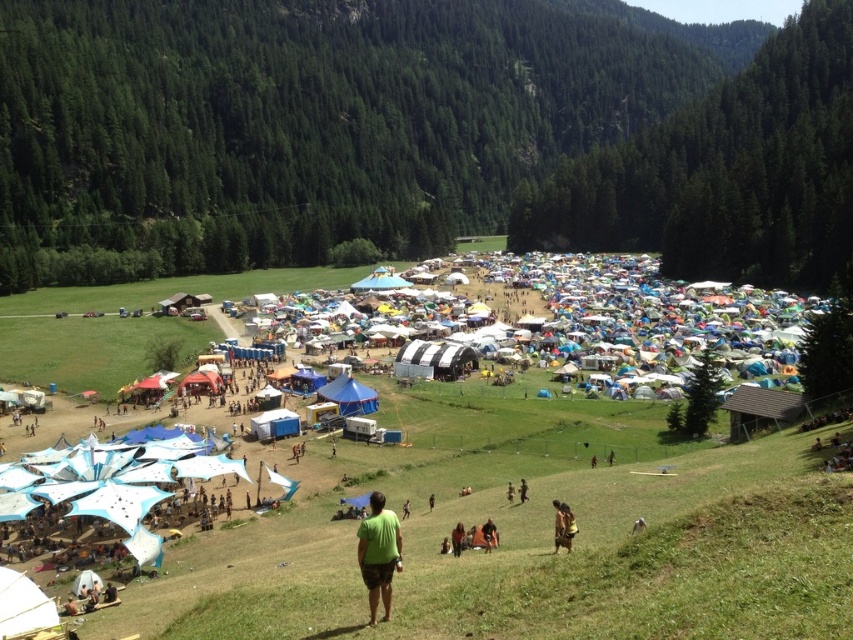
Question: Which of the following is the farthest from the observer?

Choices:
 (A) blue fabric tent at center
 (B) green matte shirt at lower center

Answer: (A)

Question: Where is green matte shirt at lower center located in relation to blue fabric tent at center in the image?

Choices:
 (A) above
 (B) below

Answer: (B)

Question: Can you confirm if green matte shirt at lower center is positioned to the right of blue fabric tent at center?

Choices:
 (A) no
 (B) yes

Answer: (B)

Question: Can you confirm if green matte shirt at lower center is wider than blue fabric tent at center?

Choices:
 (A) yes
 (B) no

Answer: (B)

Question: Which of the following is the farthest from the observer?

Choices:
 (A) green matte shirt at lower center
 (B) blue fabric tent at center

Answer: (B)